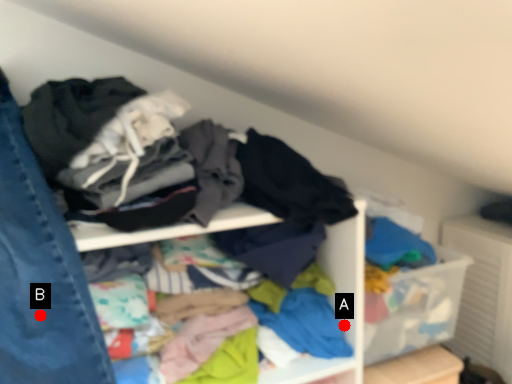
Question: Two points are circled on the image, labeled by A and B beside each circle. Which point is further to the camera?

Choices:
 (A) A is further
 (B) B is further

Answer: (A)